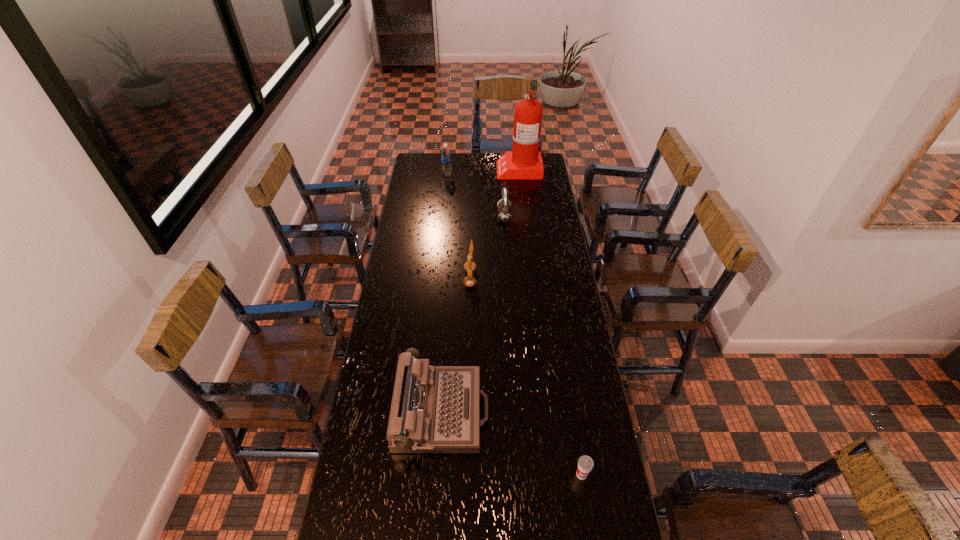
Locate an element on the screen. The height and width of the screenshot is (540, 960). unoccupied area between the water bottle and the third farthest object is located at coordinates (476, 195).

Locate an element on the screen. free space that is in between the shortest object and the nearer earphone is located at coordinates (526, 376).

You are a GUI agent. You are given a task and a screenshot of the screen. Output one action in this format:
    pyautogui.click(x=<x>, y=<y>)
    Task: Click on the vacant space in between the third farthest object and the tallest object
    This screenshot has width=960, height=540.
    Given the screenshot: What is the action you would take?
    pyautogui.click(x=512, y=192)

Locate an element on the screen. Image resolution: width=960 pixels, height=540 pixels. free spot between the second nearest object and the fire extinguisher is located at coordinates (x=480, y=291).

Locate an element on the screen. This screenshot has width=960, height=540. free space between the farther earphone and the water bottle is located at coordinates (476, 195).

This screenshot has height=540, width=960. Find the location of `vacant space in between the fourth nearest object and the left earphone`. vacant space in between the fourth nearest object and the left earphone is located at coordinates (487, 247).

Locate an element on the screen. Image resolution: width=960 pixels, height=540 pixels. empty space that is in between the nearest object and the water bottle is located at coordinates (515, 325).

You are a GUI agent. You are given a task and a screenshot of the screen. Output one action in this format:
    pyautogui.click(x=<x>, y=<y>)
    Task: Click on the free spot between the water bottle and the fifth farthest object
    This screenshot has height=540, width=960.
    Given the screenshot: What is the action you would take?
    pyautogui.click(x=444, y=293)

Identify the location of object that ranks as the fifth closest to the cup. (445, 153).

Where is `object identified as the closest to the typewriter`? The image size is (960, 540). object identified as the closest to the typewriter is located at coordinates (585, 464).